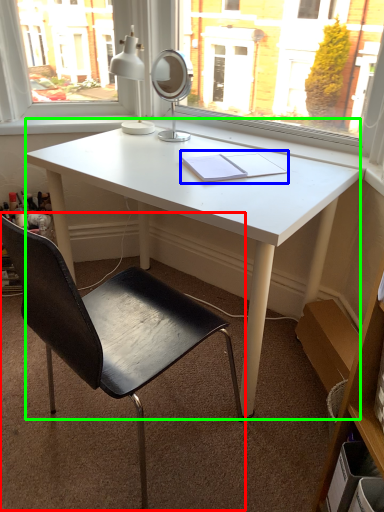
Question: Estimate the real-world distances between objects in this image. Which object is farther from chair (highlighted by a red box), notebook (highlighted by a blue box) or desk (highlighted by a green box)?

Choices:
 (A) notebook
 (B) desk

Answer: (A)